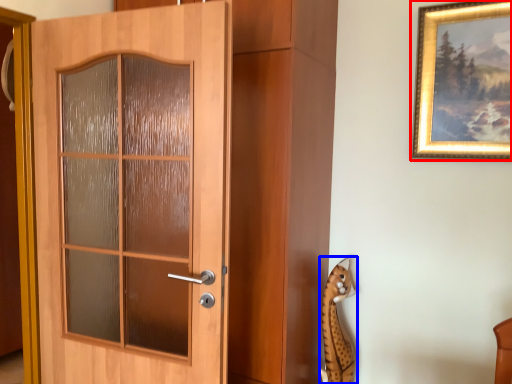
Question: Among these objects, which one is farthest to the camera, picture frame (highlighted by a red box) or animal (highlighted by a blue box)?

Choices:
 (A) picture frame
 (B) animal

Answer: (B)